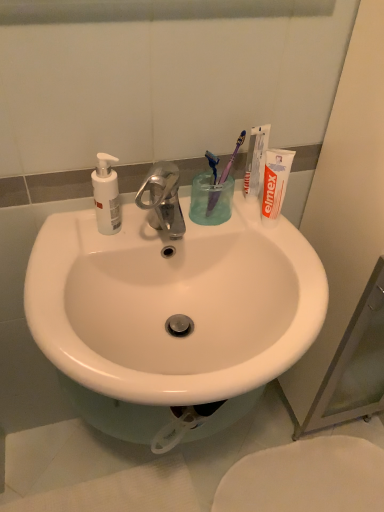
At what (x,y) coordinates should I click in order to perform the action: click on vacant space underneath white glossy sink at center (from a real-world perspective). Please return your answer as a coordinate pair (x, y). The height and width of the screenshot is (512, 384). Looking at the image, I should click on (158, 473).